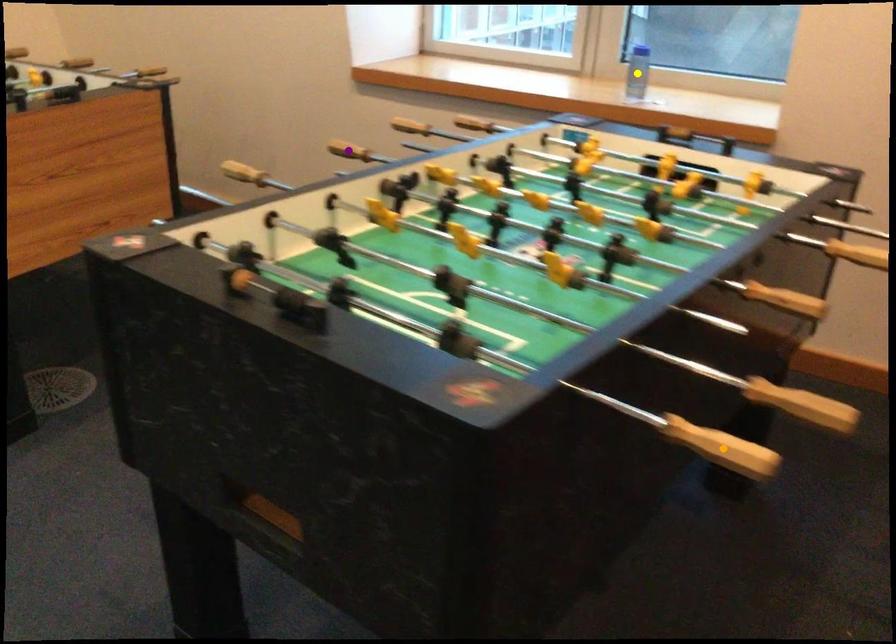
Order these from nearest to farthest:
purple point, orange point, yellow point

yellow point, purple point, orange point